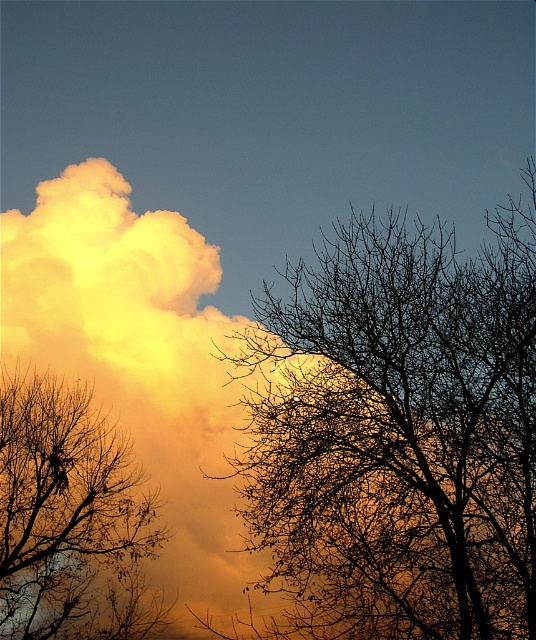
Can you confirm if silhouette bare tree at center is shorter than silhouette bare branches at left?

Indeed, silhouette bare tree at center has a lesser height compared to silhouette bare branches at left.

Is silhouette bare tree at center positioned before silhouette bare branches at left?

Yes, silhouette bare tree at center is in front of silhouette bare branches at left.

Describe the element at coordinates (399, 433) in the screenshot. I see `silhouette bare tree at center` at that location.

I want to click on silhouette bare tree at center, so click(x=399, y=433).